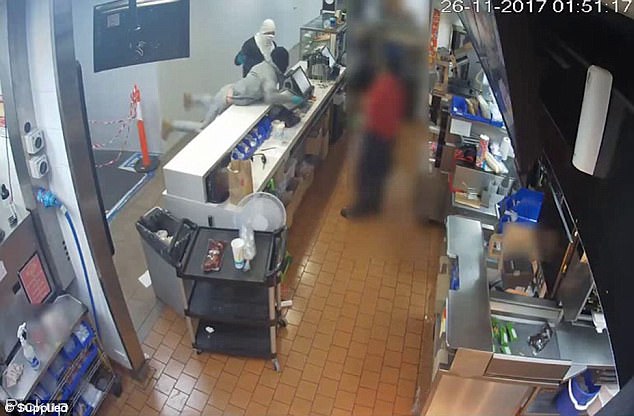
Find the location of a particular element. ordering counter is located at coordinates (233, 122).